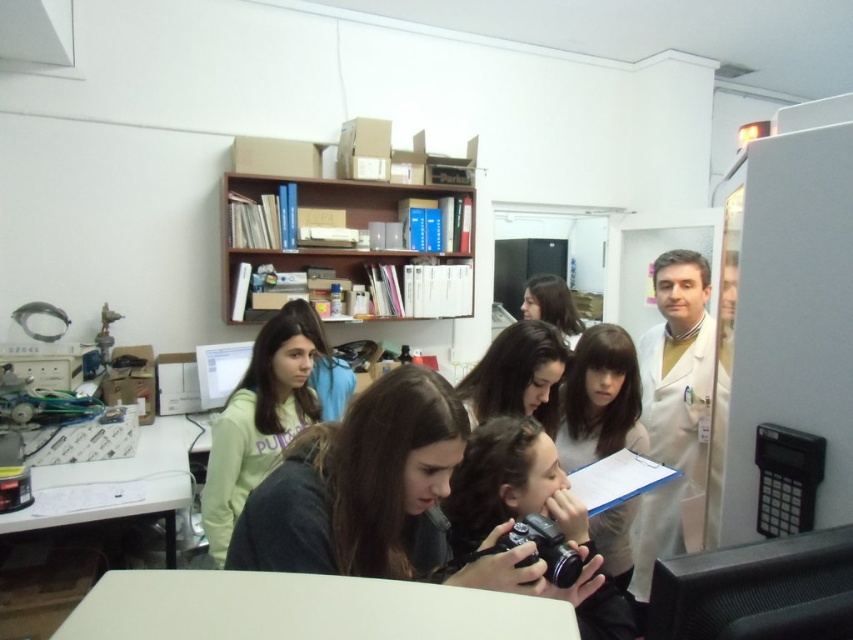
Question: Can you confirm if white lab coat at right is thinner than light green sweatshirt at center?

Choices:
 (A) no
 (B) yes

Answer: (A)

Question: Does white matte table at lower center have a greater width compared to white lab coat at right?

Choices:
 (A) yes
 (B) no

Answer: (A)

Question: Which of the following is the closest to the observer?

Choices:
 (A) (660, 314)
 (B) (515, 596)
 (C) (258, 451)
 (D) (341, 262)

Answer: (B)

Question: Is white lab coat at right wider than white glossy table at lower left?

Choices:
 (A) yes
 (B) no

Answer: (B)

Question: Which object appears farthest from the camera in this image?

Choices:
 (A) smooth beige shirt at center
 (B) wooden bookshelf at upper center

Answer: (B)

Question: Which of the following is the closest to the observer?

Choices:
 (A) (212, 532)
 (B) (602, 337)
 (C) (473, 260)

Answer: (B)